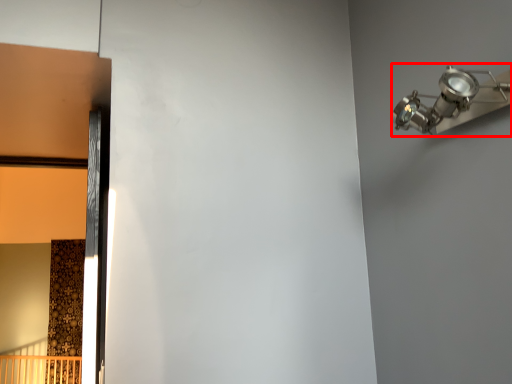
Question: From the image's perspective, what is the correct spatial positioning of light fixture (annotated by the red box) in reference to door?

Choices:
 (A) above
 (B) below

Answer: (A)